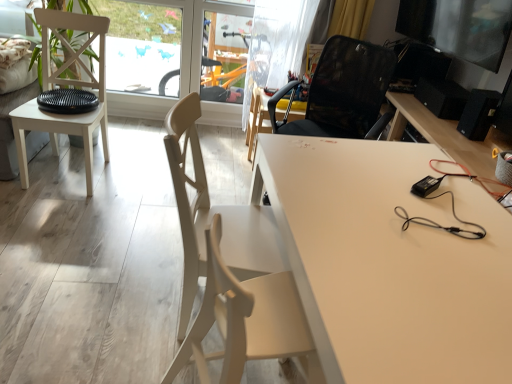
This screenshot has width=512, height=384. I want to click on vacant space that is in between white matte chair at left, which is the second chair from back to front, and matte white chair at center, marked as the third chair in a back-to-front arrangement, so click(121, 225).